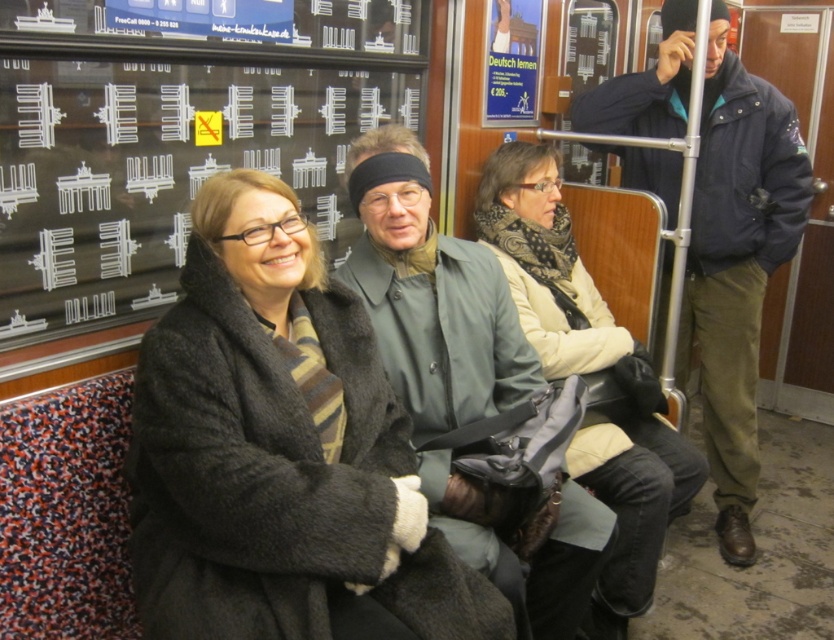
Between point (539, 544) and point (544, 188), which one is positioned in front?

Point (539, 544) is in front.

Who is positioned more to the left, green matte coat at center or beige fabric coat at center?

green matte coat at center is more to the left.

Find the location of `green matte coat at center`. green matte coat at center is located at coordinates (431, 296).

Is dark gray wool coat at center bigger than leather seat at center?

Incorrect, dark gray wool coat at center is not larger than leather seat at center.

Can you confirm if dark gray wool coat at center is thinner than leather seat at center?

In fact, dark gray wool coat at center might be wider than leather seat at center.

Between point (244, 465) and point (691, 20), which one is positioned behind?

Point (691, 20)

At what (x,y) coordinates should I click in order to perform the action: click on dark gray wool coat at center. Please return your answer as a coordinate pair (x, y). Image resolution: width=834 pixels, height=640 pixels. Looking at the image, I should click on (280, 451).

The width and height of the screenshot is (834, 640). What do you see at coordinates (431, 296) in the screenshot? I see `green matte coat at center` at bounding box center [431, 296].

Can you confirm if green matte coat at center is bigger than leather seat at center?

Actually, green matte coat at center might be smaller than leather seat at center.

This screenshot has height=640, width=834. I want to click on green matte coat at center, so click(x=431, y=296).